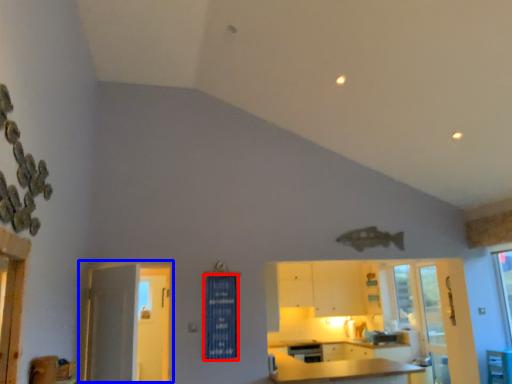
Question: Which point is closer to the camera, curtain (highlighted by a red box) or door (highlighted by a blue box)?

Choices:
 (A) curtain
 (B) door

Answer: (B)